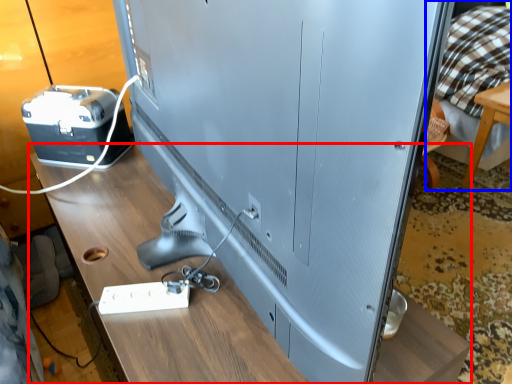
Question: Which point is further to the camera, table (highlighted by a red box) or bed (highlighted by a blue box)?

Choices:
 (A) table
 (B) bed

Answer: (B)